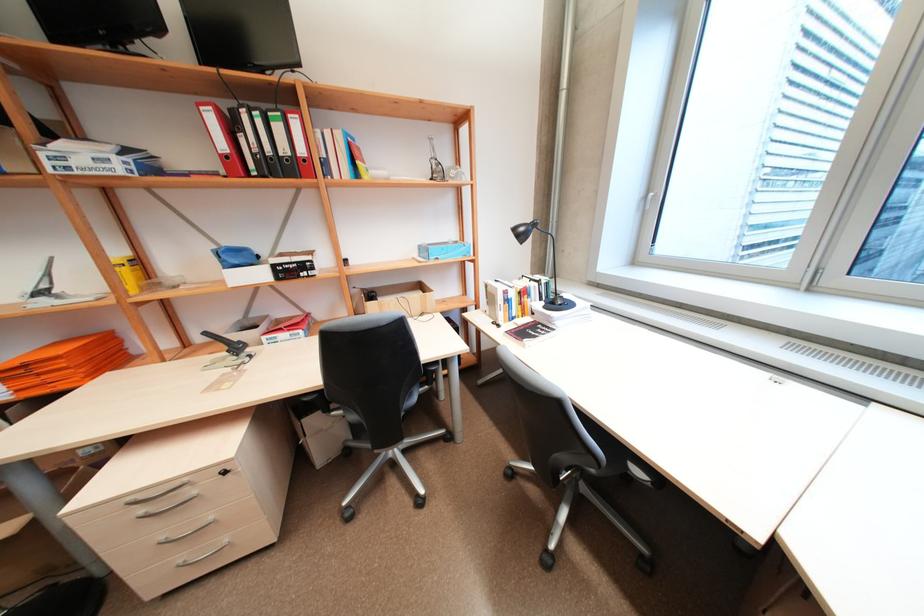
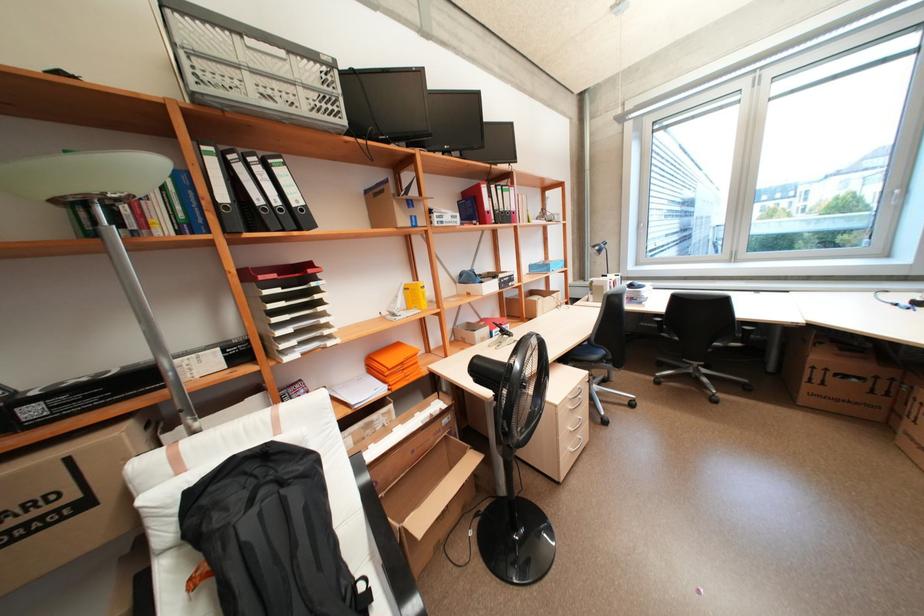
Question: In a continuous first-person perspective shot, in which direction is the camera moving?

Choices:
 (A) Left
 (B) Right
 (C) Forward
 (D) Backward

Answer: (A)